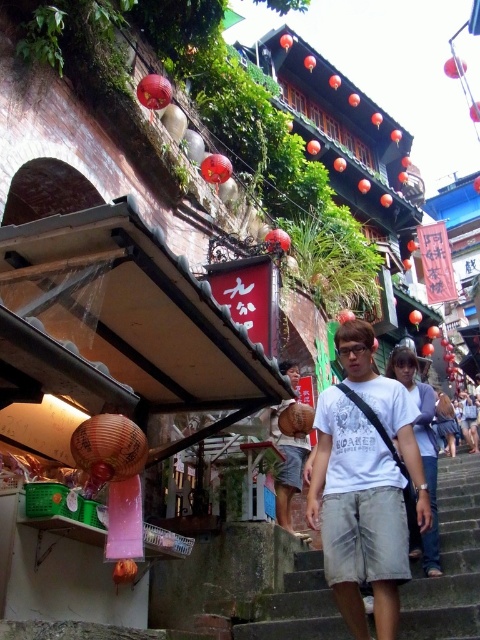
Question: Does gray concrete stairs at center lie in front of matte brown woven basket at center?

Choices:
 (A) yes
 (B) no

Answer: (A)

Question: Which of the following is the closest to the observer?

Choices:
 (A) gray concrete stairs at center
 (B) matte brown woven basket at center
 (C) white cotton t-shirt at center

Answer: (C)

Question: Observing the image, what is the correct spatial positioning of white cotton t-shirt at center in reference to matte brown woven basket at center?

Choices:
 (A) below
 (B) above

Answer: (A)

Question: Which is nearer to the gray concrete stairs at center?

Choices:
 (A) matte brown woven basket at center
 (B) white cotton t-shirt at center

Answer: (B)

Question: Estimate the real-world distances between objects in this image. Which object is farther from the white cotton t-shirt at center?

Choices:
 (A) gray concrete stairs at center
 (B) matte brown woven basket at center

Answer: (B)

Question: Does gray concrete stairs at center appear over matte brown woven basket at center?

Choices:
 (A) no
 (B) yes

Answer: (A)